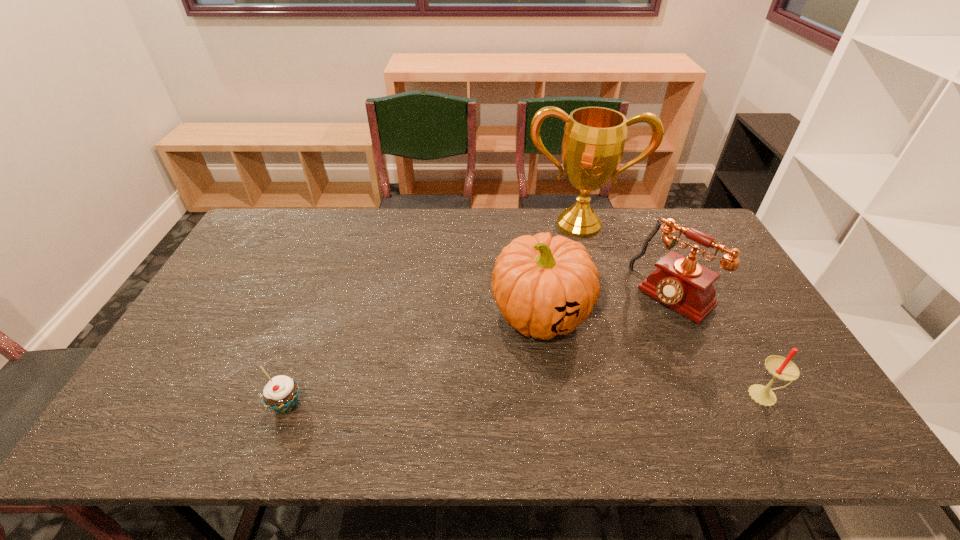
Locate an element on the screen. free location located on the dial of the telephone is located at coordinates [568, 395].

This screenshot has width=960, height=540. In order to click on blank area located 0.380m on the dial of the telephone in this screenshot , I will do `click(568, 395)`.

Identify the location of vacant position located on the surface of the pumpkin. This screenshot has height=540, width=960. (490, 404).

Identify the location of free location located 0.130m on the surface of the pumpkin. This screenshot has height=540, width=960. (499, 388).

You are a GUI agent. You are given a task and a screenshot of the screen. Output one action in this format:
    pyautogui.click(x=<x>, y=<y>)
    Task: Click on the free space located 0.050m on the surface of the pumpkin
    The width and height of the screenshot is (960, 540).
    Given the screenshot: What is the action you would take?
    pyautogui.click(x=513, y=364)

Find the location of a particular element. The height and width of the screenshot is (540, 960). vacant space located 0.210m on the front-facing side of the tallest object is located at coordinates (573, 281).

I want to click on free region located on the front-facing side of the tallest object, so click(574, 260).

Locate an element on the screen. free space located 0.260m on the front-facing side of the tallest object is located at coordinates (573, 292).

You are a GUI agent. You are given a task and a screenshot of the screen. Output one action in this format:
    pyautogui.click(x=<x>, y=<y>)
    Task: Click on the object located at the far edge
    This screenshot has height=540, width=960.
    Given the screenshot: What is the action you would take?
    pyautogui.click(x=594, y=138)

You are a GUI agent. You are given a task and a screenshot of the screen. Output one action in this format:
    pyautogui.click(x=<x>, y=<y>)
    Task: Click on the cupcake positioned at the near edge
    The image size is (960, 540).
    Given the screenshot: What is the action you would take?
    pyautogui.click(x=281, y=393)